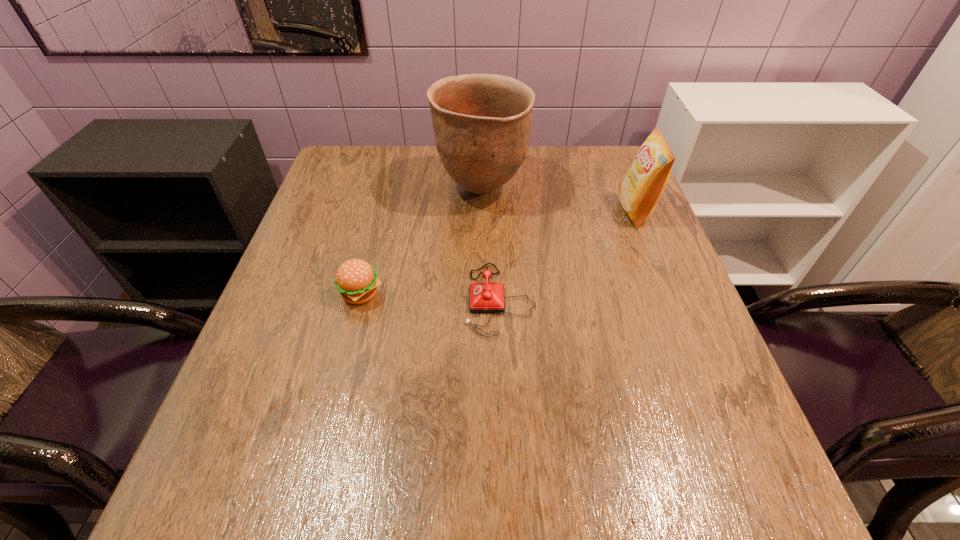
Where is `vacant space in between the crisp (potato chip) and the telephone`? The image size is (960, 540). vacant space in between the crisp (potato chip) and the telephone is located at coordinates (567, 255).

This screenshot has height=540, width=960. Find the location of `free space between the shortest object and the pottery`. free space between the shortest object and the pottery is located at coordinates (491, 245).

At what (x,y) coordinates should I click in order to perform the action: click on free space between the telephone and the second shortest object. Please return your answer as a coordinate pair (x, y). The image size is (960, 540). Looking at the image, I should click on (430, 297).

Identify which object is the third closest to the third shortest object. Please provide its 2D coordinates. Your answer should be formatted as a tuple, i.e. [(x, y)], where the tuple contains the x and y coordinates of a point satisfying the conditions above.

[(356, 280)]

Choose which object is the nearest neighbor to the telephone. Please provide its 2D coordinates. Your answer should be formatted as a tuple, i.e. [(x, y)], where the tuple contains the x and y coordinates of a point satisfying the conditions above.

[(482, 122)]